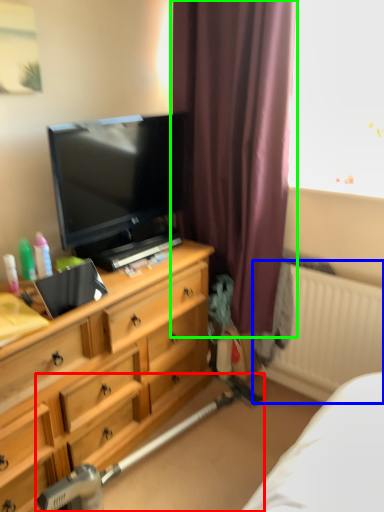
Question: Based on their relative distances, which object is farther from equipment (highlighted by a red box)? Choose from radiator (highlighted by a blue box) and curtain (highlighted by a green box).

Choices:
 (A) radiator
 (B) curtain

Answer: (B)